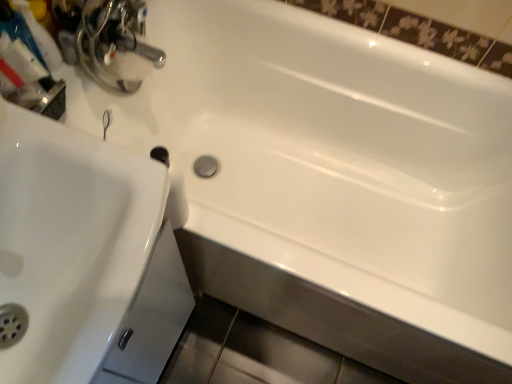
What do you see at coordinates (69, 244) in the screenshot?
I see `white glossy sink at upper left` at bounding box center [69, 244].

Image resolution: width=512 pixels, height=384 pixels. I want to click on white glossy sink at upper left, so click(x=69, y=244).

Where is `white glossy sink at upper left`? white glossy sink at upper left is located at coordinates (69, 244).